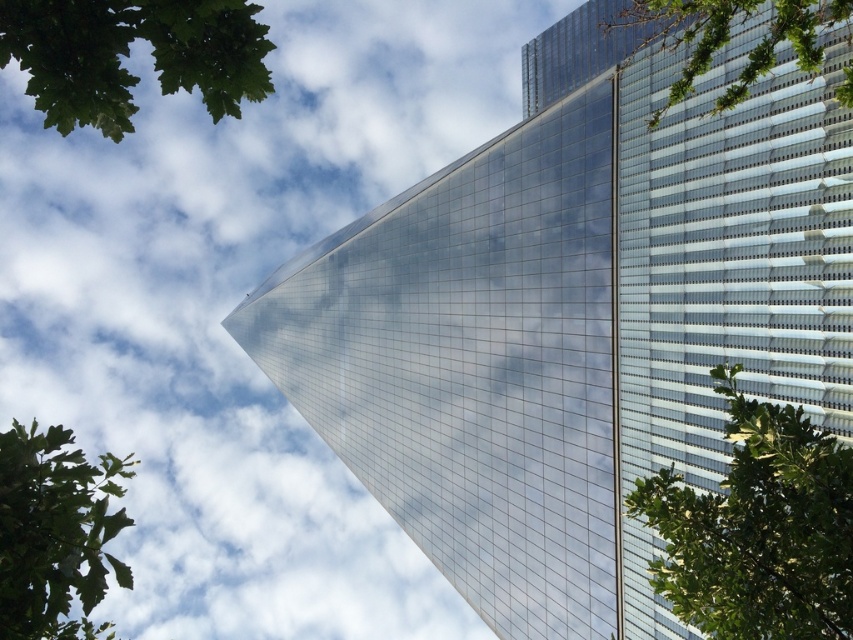
Between transparent glass tower at center and green leafy tree at right, which one is positioned higher?

transparent glass tower at center is above.

Image resolution: width=853 pixels, height=640 pixels. I want to click on transparent glass tower at center, so click(x=577, y=320).

Does green leafy tree at upper left appear on the right side of green leafy tree at upper right?

In fact, green leafy tree at upper left is to the left of green leafy tree at upper right.

This screenshot has height=640, width=853. Identify the location of green leafy tree at upper left. (128, 54).

The image size is (853, 640). What do you see at coordinates (54, 532) in the screenshot?
I see `green leafy tree at lower left` at bounding box center [54, 532].

Is green leafy tree at lower left shorter than green leafy tree at upper right?

Correct, green leafy tree at lower left is not as tall as green leafy tree at upper right.

Locate an element on the screen. The width and height of the screenshot is (853, 640). green leafy tree at lower left is located at coordinates coord(54,532).